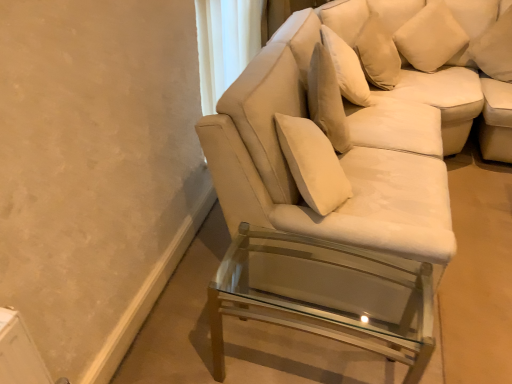
Question: From the image's perspective, is clear glass table at lower right above or below white soft cushion at upper right, arranged as the first pillow when viewed from the right?

Choices:
 (A) above
 (B) below

Answer: (B)

Question: Is point (366, 258) closer or farther from the camera than point (496, 74)?

Choices:
 (A) closer
 (B) farther

Answer: (A)

Question: Considering the real-world distances, which object is farthest from the white fabric couch at center?

Choices:
 (A) white soft cushion at upper right, which ranks as the second pillow in right-to-left order
 (B) clear glass table at lower right
 (C) white soft cushion at upper right, the 2th pillow viewed from the left

Answer: (C)

Question: Based on their relative distances, which object is nearer to the white soft cushion at upper right, arranged as the first pillow when viewed from the right?

Choices:
 (A) white soft cushion at upper right, which ranks as the first pillow in left-to-right order
 (B) white fabric couch at center
 (C) clear glass table at lower right

Answer: (A)